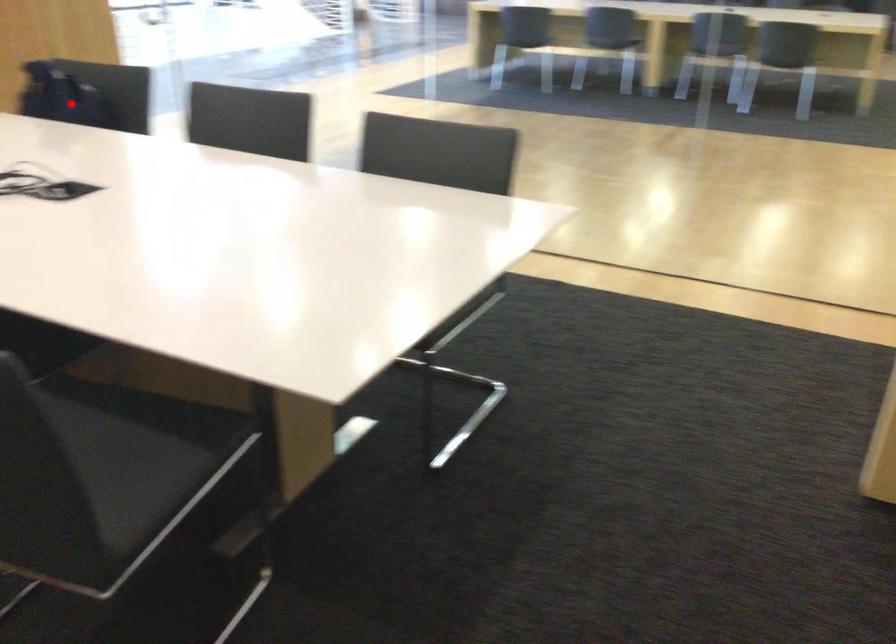
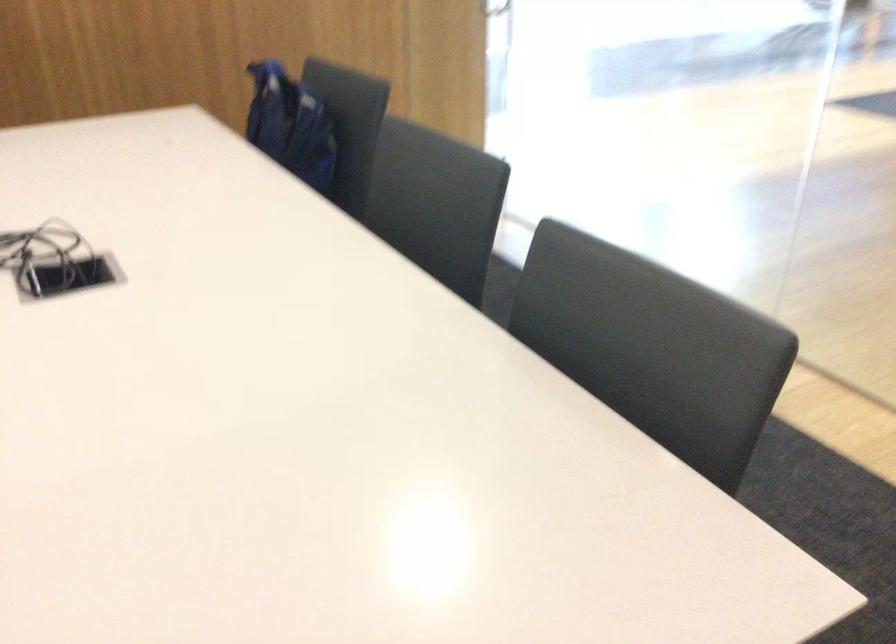
In the second image, find the point that corresponds to the highlighted location in the first image.

(289, 125)